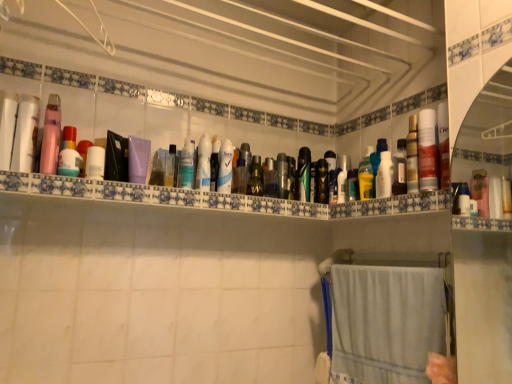
Question: From the image's perspective, is matte black can at center, which is the 6th toiletry from right to left, located beneath pink matte lotion at upper left, the second toiletry from the left?

Choices:
 (A) yes
 (B) no

Answer: (A)

Question: Considering the relative sizes of matte black can at center, marked as the seventeenth toiletry in a left-to-right arrangement, and pink matte lotion at upper left, the 21th toiletry in the right-to-left sequence, in the image provided, is matte black can at center, marked as the seventeenth toiletry in a left-to-right arrangement, wider than pink matte lotion at upper left, the 21th toiletry in the right-to-left sequence,?

Choices:
 (A) no
 (B) yes

Answer: (A)

Question: Is the position of matte black can at center, which is the 6th toiletry from right to left, less distant than that of pink matte lotion at upper left, the second toiletry from the left?

Choices:
 (A) yes
 (B) no

Answer: (B)

Question: From a real-world perspective, is matte black can at center, marked as the seventeenth toiletry in a left-to-right arrangement, located beneath pink matte lotion at upper left, the 21th toiletry in the right-to-left sequence?

Choices:
 (A) yes
 (B) no

Answer: (B)

Question: Is the depth of matte black can at center, which is the 6th toiletry from right to left, greater than that of pink matte lotion at upper left, the 21th toiletry in the right-to-left sequence?

Choices:
 (A) yes
 (B) no

Answer: (A)

Question: Would you say clear plastic bottle at upper center, the 21th toiletry in the left-to-right sequence, is to the left or to the right of green matte bottle at center, placed as the 12th toiletry when sorted from right to left, in the picture?

Choices:
 (A) right
 (B) left

Answer: (A)

Question: Considering the positions of point (393, 173) and point (261, 185), is point (393, 173) closer or farther from the camera than point (261, 185)?

Choices:
 (A) closer
 (B) farther

Answer: (A)

Question: Is clear plastic bottle at upper center, the 21th toiletry in the left-to-right sequence, in front of or behind green matte bottle at center, placed as the 12th toiletry when sorted from right to left, in the image?

Choices:
 (A) behind
 (B) front

Answer: (B)

Question: From the image's perspective, relative to green matte bottle at center, placed as the 12th toiletry when sorted from right to left, is clear plastic bottle at upper center, the 21th toiletry in the left-to-right sequence, above or below?

Choices:
 (A) above
 (B) below

Answer: (A)

Question: Which is correct: matte white can at right, acting as the 22th toiletry starting from the left, is inside translucent plastic bottles at upper center, or outside of it?

Choices:
 (A) outside
 (B) inside

Answer: (A)

Question: Considering the positions of matte white can at right, acting as the 22th toiletry starting from the left, and translucent plastic bottles at upper center in the image, is matte white can at right, acting as the 22th toiletry starting from the left, wider or thinner than translucent plastic bottles at upper center?

Choices:
 (A) wide
 (B) thin

Answer: (B)

Question: Visually, is matte white can at right, acting as the 22th toiletry starting from the left, positioned to the left or to the right of translucent plastic bottles at upper center?

Choices:
 (A) left
 (B) right

Answer: (B)

Question: Is matte white can at right, acting as the 22th toiletry starting from the left, bigger or smaller than translucent plastic bottles at upper center?

Choices:
 (A) big
 (B) small

Answer: (B)

Question: Is green matte toothbrush at center, acting as the 15th toiletry starting from the left, inside the boundaries of purple matte bottle at center, placed as the 18th toiletry when sorted from right to left, or outside?

Choices:
 (A) outside
 (B) inside

Answer: (A)

Question: Would you say green matte toothbrush at center, which ranks as the eighth toiletry in right-to-left order, is to the left or to the right of purple matte bottle at center, placed as the 18th toiletry when sorted from right to left, in the picture?

Choices:
 (A) left
 (B) right

Answer: (B)